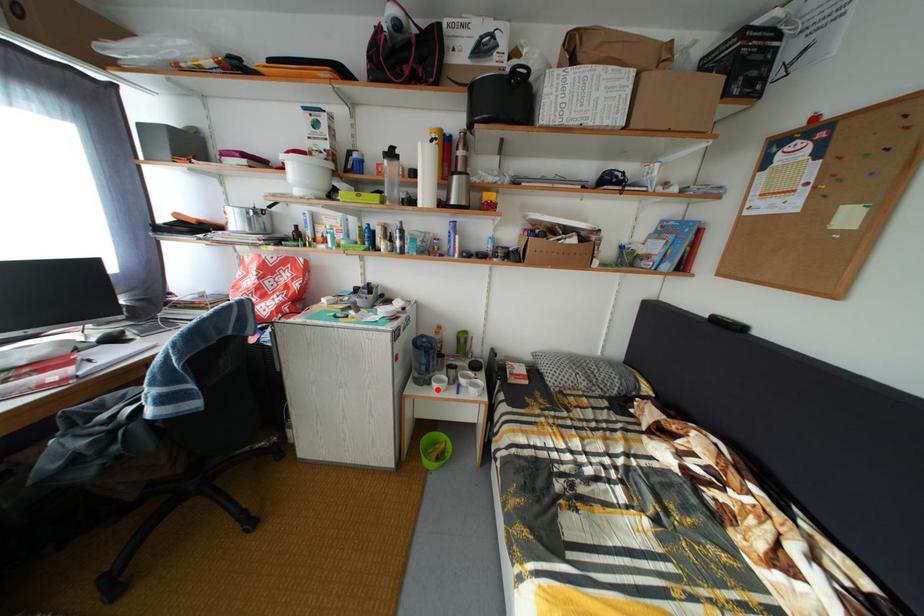
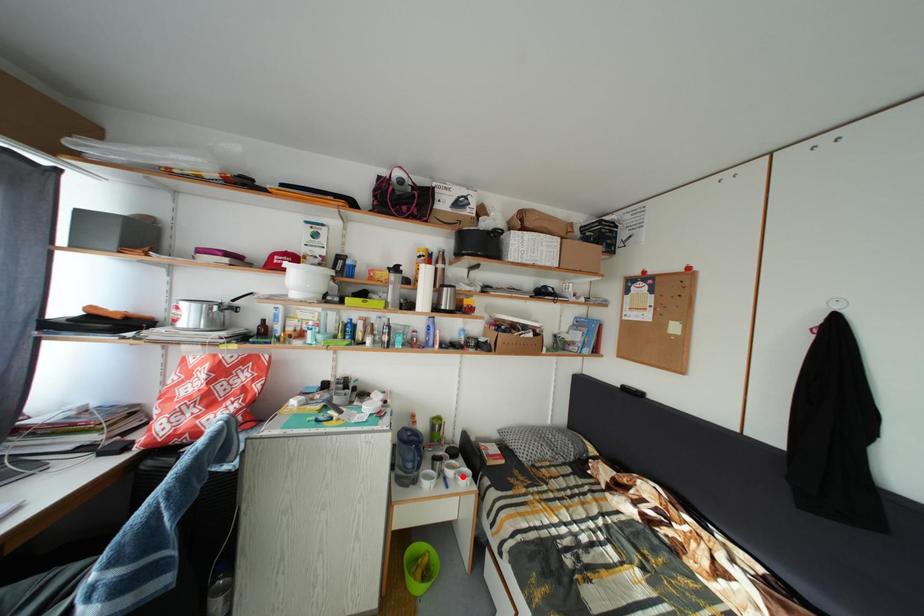
I am providing you with two images of the same scene from different viewpoints. A red point is marked on the first image and another point is marked on the second image. Does the point marked in image1 correspond to the same location as the one in image2?

No